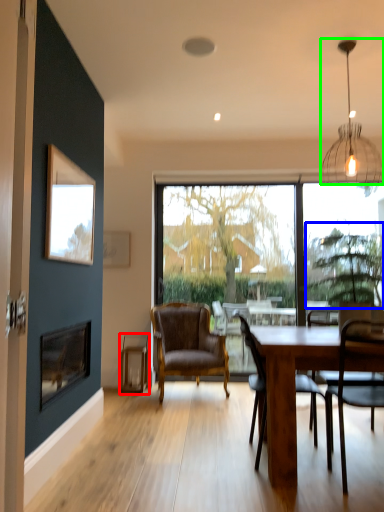
Question: Which object is the farthest from plank (highlighted by a red box)? Choose among these: tree (highlighted by a blue box) or lamp (highlighted by a green box).

Choices:
 (A) tree
 (B) lamp

Answer: (B)